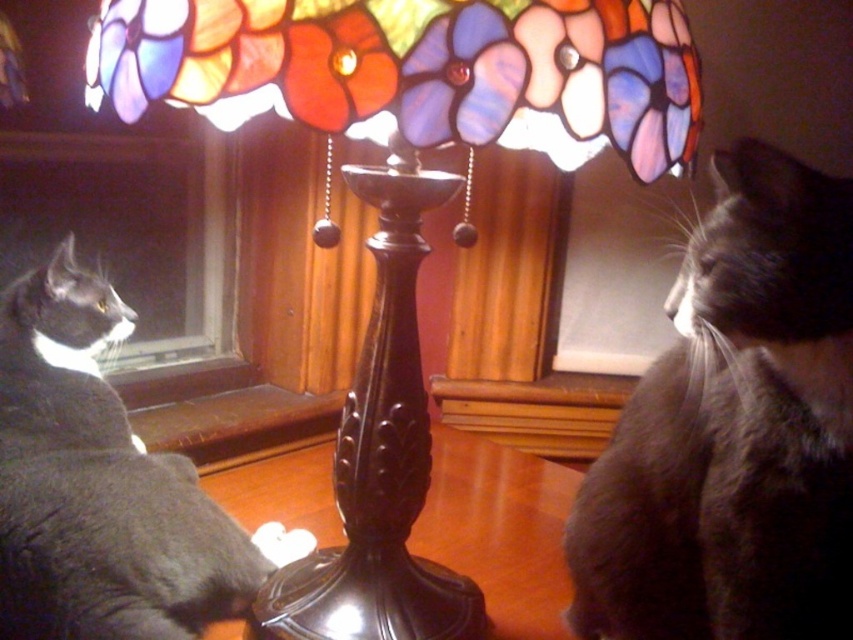
Question: Can you confirm if gray fur cat at upper right is positioned below gray fur cat at left?

Choices:
 (A) no
 (B) yes

Answer: (A)

Question: Which of the following is the farthest from the observer?

Choices:
 (A) black polished wood table at center
 (B) gray fur cat at upper right
 (C) stained glass lampshade at center
 (D) gray fur cat at left

Answer: (A)

Question: Is gray fur cat at left positioned at the back of black polished wood table at center?

Choices:
 (A) yes
 (B) no

Answer: (B)

Question: Can you confirm if stained glass lampshade at center is smaller than gray fur cat at upper right?

Choices:
 (A) yes
 (B) no

Answer: (B)

Question: Which point appears farthest from the camera in this image?

Choices:
 (A) (762, 512)
 (B) (422, 33)
 (C) (477, 509)
 (D) (33, 433)

Answer: (C)

Question: Estimate the real-world distances between objects in this image. Which object is closer to the black polished wood table at center?

Choices:
 (A) gray fur cat at left
 (B) gray fur cat at upper right

Answer: (A)